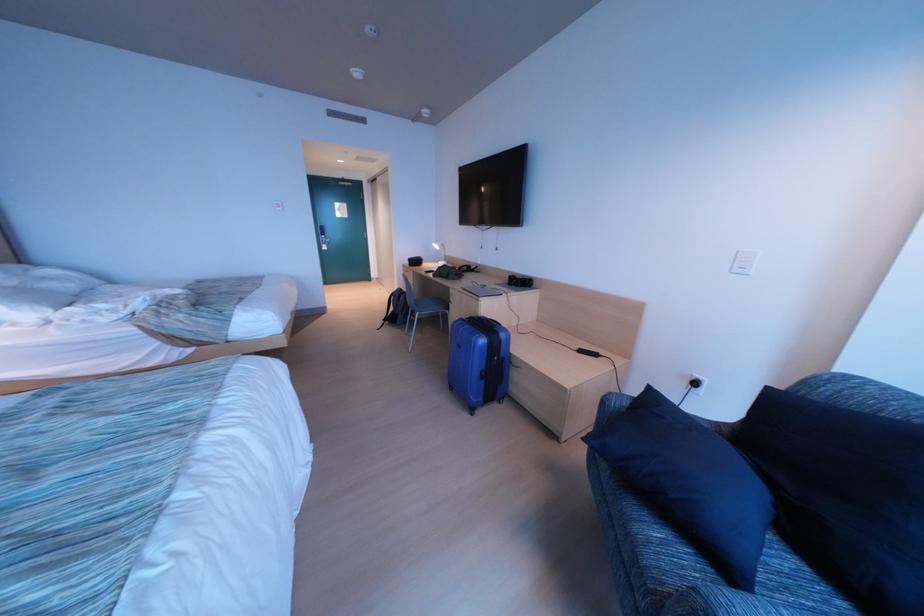
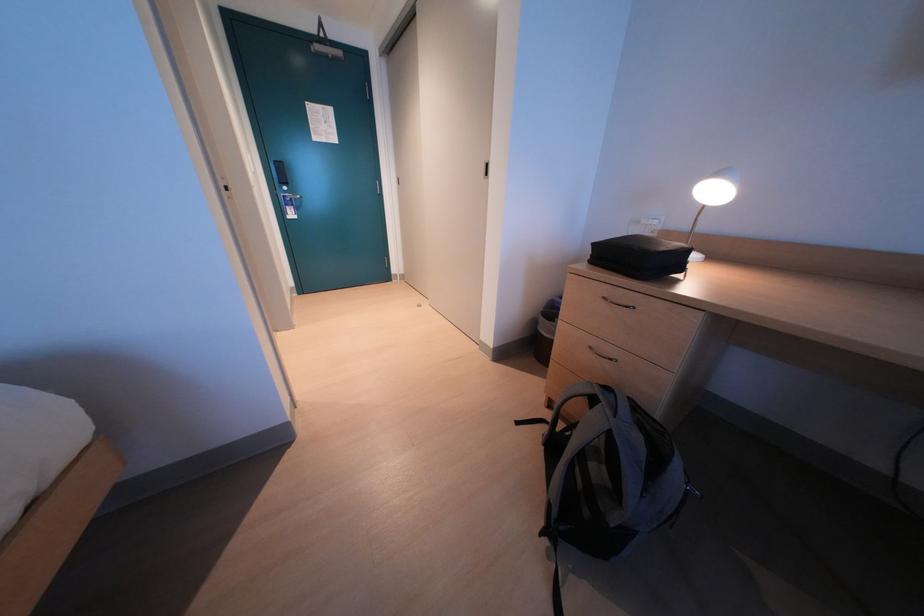
The images are taken continuously from a first-person perspective. In which direction are you moving?

The movement direction of the cameraman is left, forward.